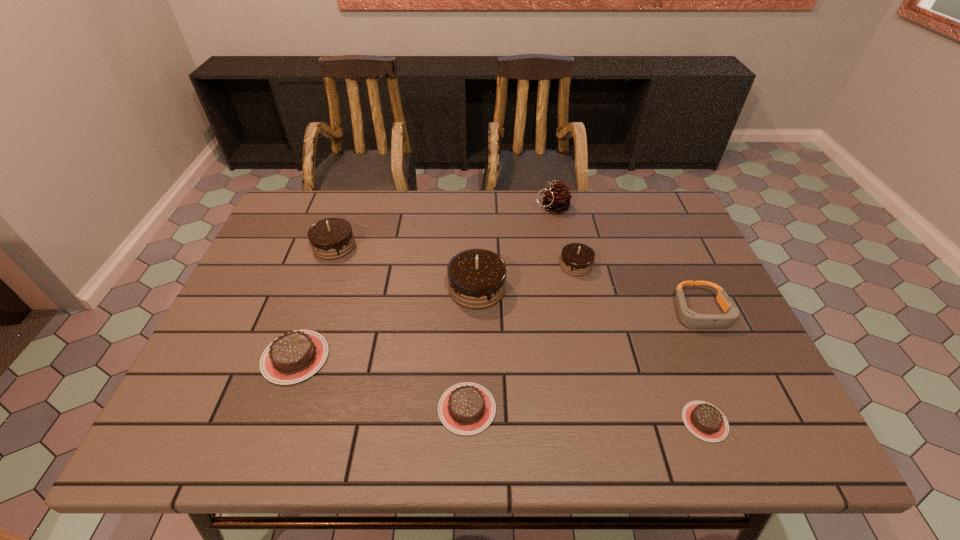
Identify the location of empty location between the second smallest brown chocolate cake and the rightmost brown chocolate cake. (586, 415).

Identify the location of vacant area that lies between the biggest brown chocolate cake and the brown pinecone. (423, 282).

Image resolution: width=960 pixels, height=540 pixels. In order to click on free space between the shortest object and the biggest brown chocolate cake in this screenshot , I will do `click(500, 389)`.

Locate an element on the screen. free area in between the biggest chocolate chocolate cake and the fourth shortest object is located at coordinates (589, 300).

What are the coordinates of `object that stands as the second closest to the second chocolate chocolate cake from left to right` in the screenshot? It's located at (467, 408).

I want to click on object that is the fourth closest to the leftmost chocolate chocolate cake, so click(x=557, y=199).

Point out which chocolate cake is positioned as the nearest to the sixth tallest object. Please provide its 2D coordinates. Your answer should be formatted as a tuple, i.e. [(x, y)], where the tuple contains the x and y coordinates of a point satisfying the conditions above.

[(332, 238)]

Select which chocolate cake is the fifth closest to the shortest object. Please provide its 2D coordinates. Your answer should be formatted as a tuple, i.e. [(x, y)], where the tuple contains the x and y coordinates of a point satisfying the conditions above.

[(332, 238)]

The image size is (960, 540). What are the coordinates of `chocolate chocolate cake that is the closest to the goggles` in the screenshot? It's located at (577, 259).

Point out which chocolate chocolate cake is positioned as the nearest to the second biggest chocolate chocolate cake. Please provide its 2D coordinates. Your answer should be formatted as a tuple, i.e. [(x, y)], where the tuple contains the x and y coordinates of a point satisfying the conditions above.

[(476, 277)]